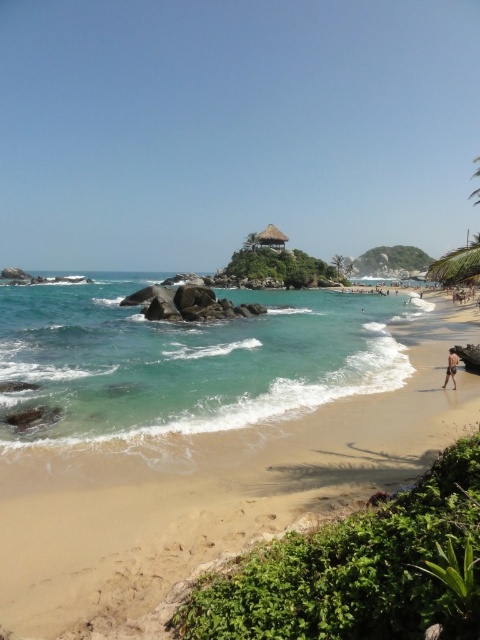
Question: Can you confirm if brown thatched hut at center is bigger than brown sandy person at lower right?

Choices:
 (A) yes
 (B) no

Answer: (A)

Question: Estimate the real-world distances between objects in this image. Which object is farther from the brown sandy person at lower right?

Choices:
 (A) brown thatched hut at center
 (B) sandy beach at lower left
 (C) clear blue water at center

Answer: (A)

Question: Which is nearer to the sandy beach at lower left?

Choices:
 (A) brown sandy person at lower right
 (B) brown thatched hut at center

Answer: (A)

Question: Estimate the real-world distances between objects in this image. Which object is closer to the brown thatched hut at center?

Choices:
 (A) brown sandy person at lower right
 (B) clear blue water at center
 (C) sandy beach at lower left

Answer: (B)

Question: Is clear blue water at center positioned in front of brown sandy person at lower right?

Choices:
 (A) yes
 (B) no

Answer: (A)

Question: Is clear blue water at center thinner than brown sandy person at lower right?

Choices:
 (A) no
 (B) yes

Answer: (A)